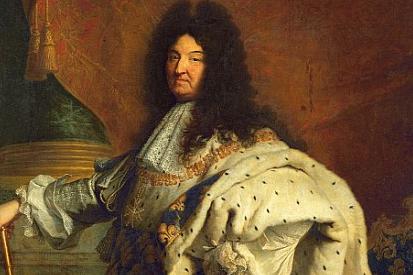
The width and height of the screenshot is (413, 275). Identify the location of coat. (316, 191).